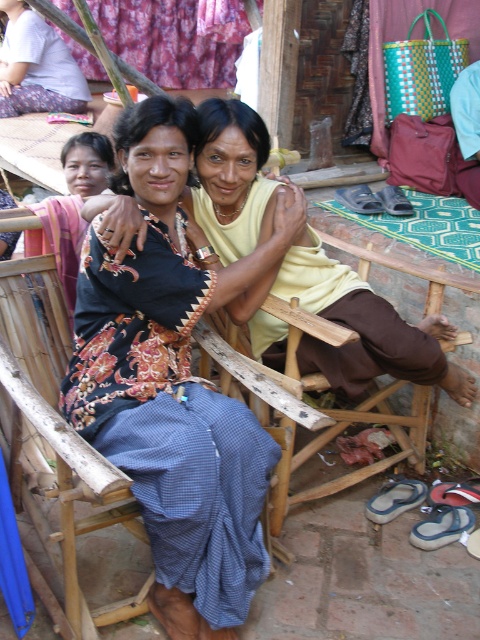
How distant is printed cotton shirt at center from white cotton shirt at upper left?

printed cotton shirt at center and white cotton shirt at upper left are 5.36 meters apart.

From the picture: Can you confirm if printed cotton shirt at center is wider than white cotton shirt at upper left?

In fact, printed cotton shirt at center might be narrower than white cotton shirt at upper left.

What are the coordinates of `printed cotton shirt at center` in the screenshot? It's located at (173, 385).

This screenshot has width=480, height=640. I want to click on printed cotton shirt at center, so click(x=173, y=385).

Which is below, printed cotton shirt at center or bamboo chair at left?

bamboo chair at left is lower down.

Can you confirm if printed cotton shirt at center is wider than bamboo chair at left?

Yes.

The image size is (480, 640). In order to click on printed cotton shirt at center in this screenshot , I will do `click(173, 385)`.

In the scene shown: Does bamboo chair at left have a lesser width compared to white cotton shirt at upper left?

Yes.

Is bamboo chair at left closer to the viewer compared to white cotton shirt at upper left?

Yes, bamboo chair at left is closer to the viewer.

Is point (74, 554) positioned before point (29, 112)?

Yes, it is.

Find the location of a particular element. This screenshot has height=640, width=480. bamboo chair at left is located at coordinates (66, 465).